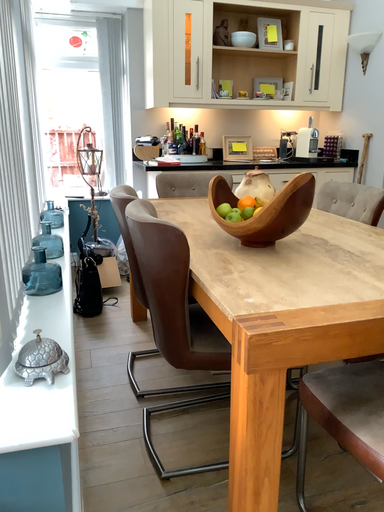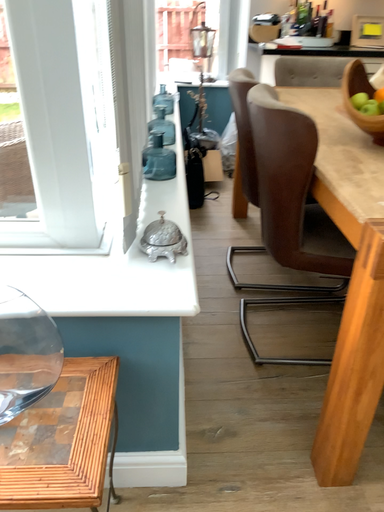
Question: Which way did the camera rotate in the video?

Choices:
 (A) rotated left
 (B) rotated right

Answer: (A)